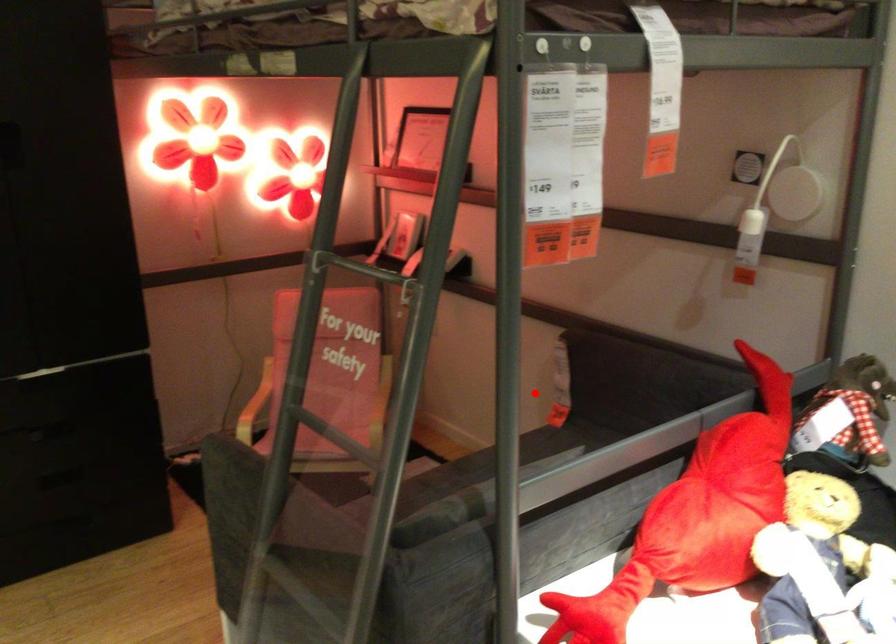
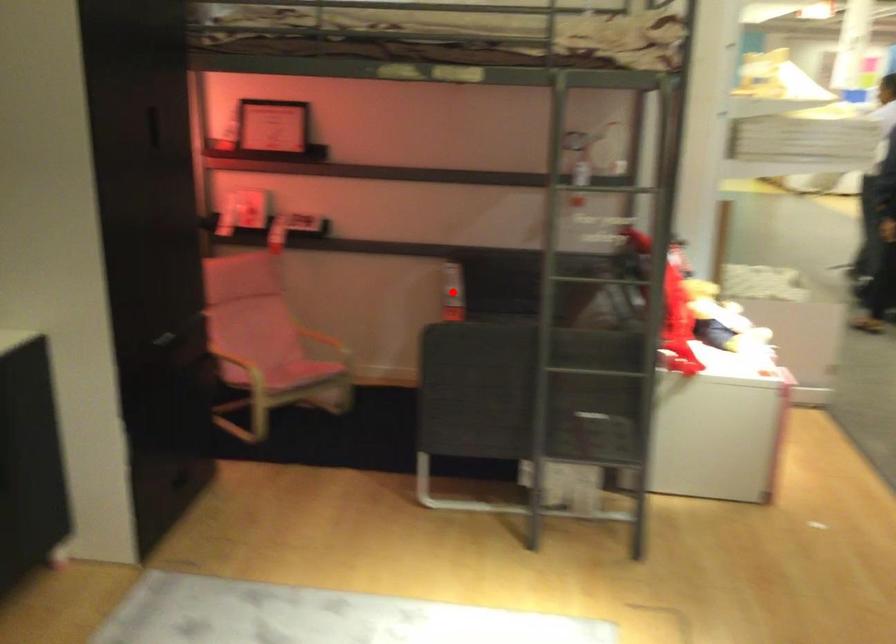
I am providing you with two images of the same scene from different viewpoints. A red point is marked on the first image and another point is marked on the second image. Do the highlighted points in image1 and image2 indicate the same real-world spot?

Yes